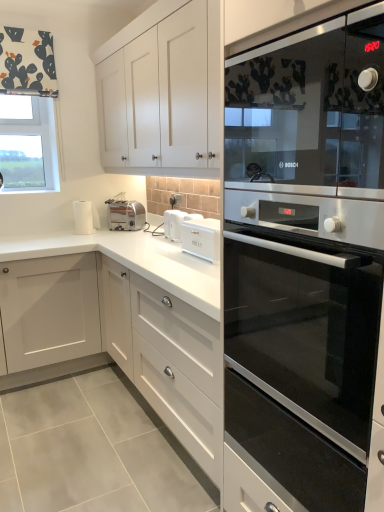
Question: Can you confirm if satin silver toaster at center, marked as the first appliance in a back-to-front arrangement, is thinner than black glass oven at right?

Choices:
 (A) no
 (B) yes

Answer: (B)

Question: Is satin silver toaster at center, marked as the first appliance in a back-to-front arrangement, looking in the opposite direction of black glass oven at right?

Choices:
 (A) no
 (B) yes

Answer: (A)

Question: Can you confirm if satin silver toaster at center, which is the second appliance in front-to-back order, is bigger than black glass oven at right?

Choices:
 (A) yes
 (B) no

Answer: (B)

Question: Is satin silver toaster at center, the 2th appliance in the right-to-left sequence, not within black glass oven at right?

Choices:
 (A) no
 (B) yes

Answer: (B)

Question: Considering the relative sizes of satin silver toaster at center, arranged as the first appliance when viewed from the left, and black glass oven at right in the image provided, is satin silver toaster at center, arranged as the first appliance when viewed from the left, taller than black glass oven at right?

Choices:
 (A) yes
 (B) no

Answer: (B)

Question: Is clear glass window at upper left spatially inside satin silver toaster at center, which is the second appliance in front-to-back order, or outside of it?

Choices:
 (A) inside
 (B) outside

Answer: (B)

Question: From a real-world perspective, is clear glass window at upper left physically located above or below satin silver toaster at center, which is the second appliance in front-to-back order?

Choices:
 (A) above
 (B) below

Answer: (A)

Question: Considering the relative positions of clear glass window at upper left and satin silver toaster at center, arranged as the first appliance when viewed from the left, in the image provided, is clear glass window at upper left to the left or to the right of satin silver toaster at center, arranged as the first appliance when viewed from the left,?

Choices:
 (A) right
 (B) left

Answer: (B)

Question: Considering the positions of clear glass window at upper left and satin silver toaster at center, arranged as the first appliance when viewed from the left, in the image, is clear glass window at upper left taller or shorter than satin silver toaster at center, arranged as the first appliance when viewed from the left,?

Choices:
 (A) tall
 (B) short

Answer: (A)

Question: Considering the positions of satin silver toaster at center, the 2th appliance in the right-to-left sequence, and black glass microwave at upper right in the image, is satin silver toaster at center, the 2th appliance in the right-to-left sequence, wider or thinner than black glass microwave at upper right?

Choices:
 (A) thin
 (B) wide

Answer: (A)

Question: Is point (109, 227) closer or farther from the camera than point (253, 79)?

Choices:
 (A) closer
 (B) farther

Answer: (B)

Question: From a real-world perspective, is satin silver toaster at center, which is the second appliance in front-to-back order, positioned above or below black glass microwave at upper right?

Choices:
 (A) above
 (B) below

Answer: (B)

Question: Is satin silver toaster at center, marked as the first appliance in a back-to-front arrangement, to the left or to the right of black glass microwave at upper right in the image?

Choices:
 (A) right
 (B) left

Answer: (B)

Question: Considering the positions of stainless steel oven at right and black glass oven at right in the image, is stainless steel oven at right wider or thinner than black glass oven at right?

Choices:
 (A) wide
 (B) thin

Answer: (B)

Question: Would you say stainless steel oven at right is inside or outside black glass oven at right?

Choices:
 (A) outside
 (B) inside

Answer: (B)